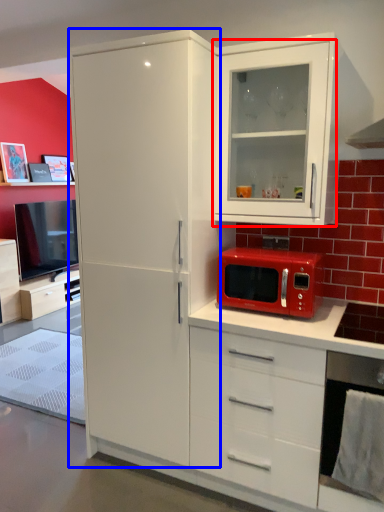
Question: Which object appears farthest to the camera in this image, cabinetry (highlighted by a red box) or refrigerator (highlighted by a blue box)?

Choices:
 (A) cabinetry
 (B) refrigerator

Answer: (A)